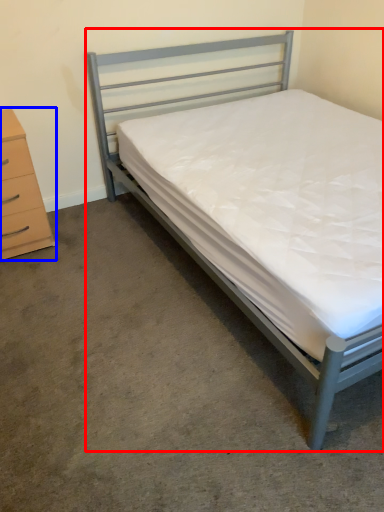
Question: Among these objects, which one is nearest to the camera, bed (highlighted by a red box) or chest of drawers (highlighted by a blue box)?

Choices:
 (A) bed
 (B) chest of drawers

Answer: (A)